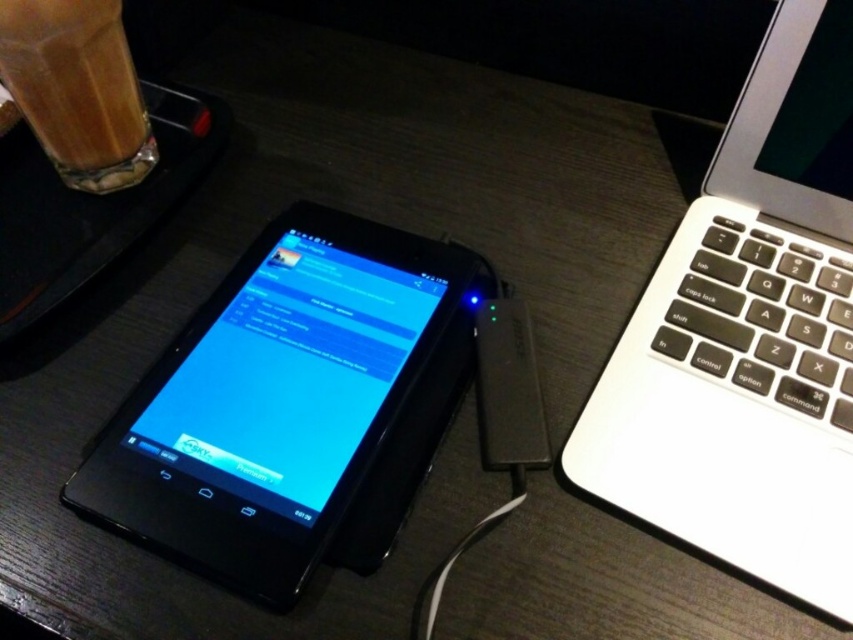
Question: Is silver metallic laptop at upper right thinner than white plastic ipod at center?

Choices:
 (A) no
 (B) yes

Answer: (A)

Question: Is silver metallic laptop at upper right to the right of white plastic ipod at center from the viewer's perspective?

Choices:
 (A) no
 (B) yes

Answer: (B)

Question: Which object is the farthest from the white plastic ipod at center?

Choices:
 (A) silver metallic laptop at upper right
 (B) black glossy tablet at center

Answer: (A)

Question: Which point appears farthest from the camera in this image?

Choices:
 (A) (97, 10)
 (B) (650, 474)
 (C) (476, 349)

Answer: (A)

Question: Does silver metallic laptop at upper right appear on the right side of white plastic ipod at center?

Choices:
 (A) no
 (B) yes

Answer: (B)

Question: Which object is closer to the camera taking this photo?

Choices:
 (A) brown translucent glass at upper left
 (B) silver metallic laptop at upper right
 (C) black glossy tablet at center
 (D) white plastic ipod at center

Answer: (C)